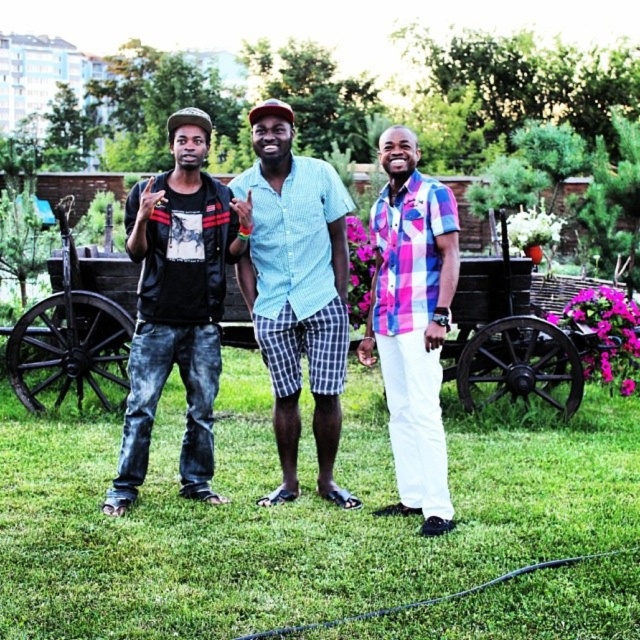
Question: Estimate the real-world distances between objects in this image. Which object is farther from the wooden wagon at center?

Choices:
 (A) light blue checkered shorts at center
 (B) pink plaid shirt at center

Answer: (B)

Question: Does wooden wagon at center appear over light blue checkered shorts at center?

Choices:
 (A) no
 (B) yes

Answer: (B)

Question: Can you confirm if denim jeans at left is positioned to the left of pink plaid shirt at center?

Choices:
 (A) yes
 (B) no

Answer: (A)

Question: Which object is closer to the camera taking this photo?

Choices:
 (A) wooden wagon at center
 (B) green grass at center
 (C) denim jeans at left

Answer: (B)

Question: In this image, where is denim jeans at left located relative to pink plaid shirt at center?

Choices:
 (A) right
 (B) left

Answer: (B)

Question: Which of the following is the closest to the observer?

Choices:
 (A) (132, 218)
 (B) (408, 512)
 (C) (16, 371)
 (D) (298, 177)

Answer: (B)